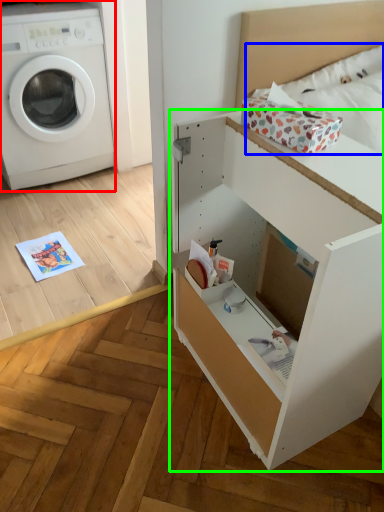
Question: Which object is positioned farthest from washing machine (highlighted by a red box)? Select from bedding (highlighted by a blue box) and file cabinet (highlighted by a green box).

Choices:
 (A) bedding
 (B) file cabinet

Answer: (B)